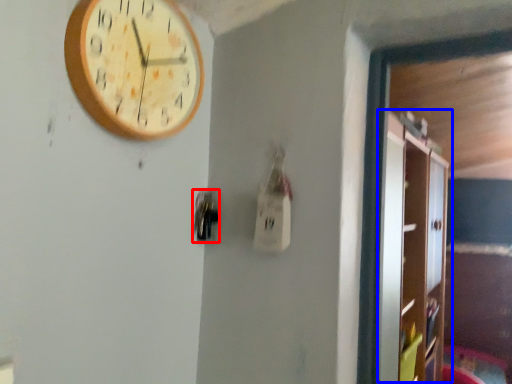
Question: Which object is further to the camera taking this photo, door handle (highlighted by a red box) or dresser (highlighted by a blue box)?

Choices:
 (A) door handle
 (B) dresser

Answer: (B)